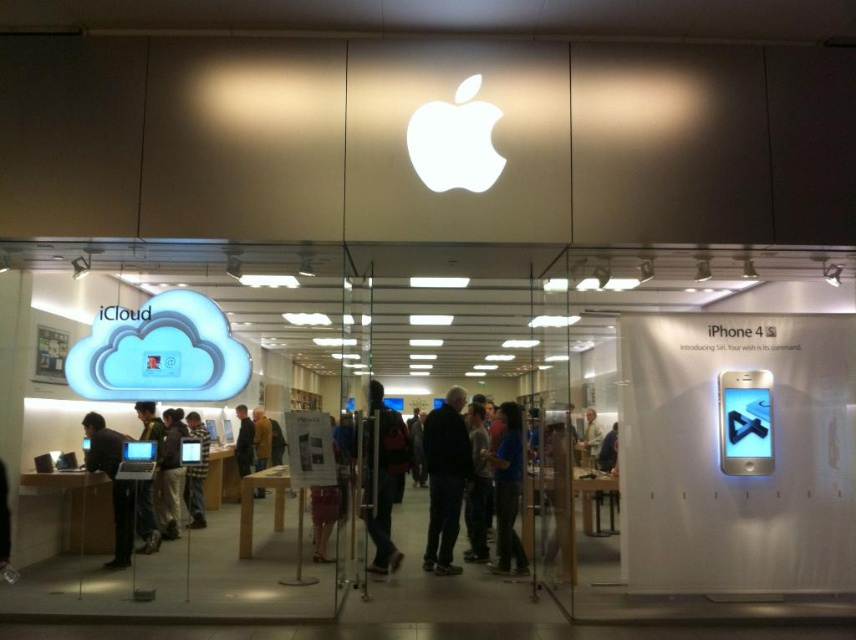
You are standing in the Apple Store and want to take a photo of the two points marked in the image. Which point, point (149, 428) or point (260, 429), will appear larger in your photo?

Point (149, 428) will appear larger in the photo because it is closer to the camera than point (260, 429).

You are a customer in an Apple Store and see both the blue fabric shirt at center and the dark brown leather jacket at center displayed in the store. Which item is located to the right of the other?

The blue fabric shirt at center is positioned on the right side of dark brown leather jacket at center.